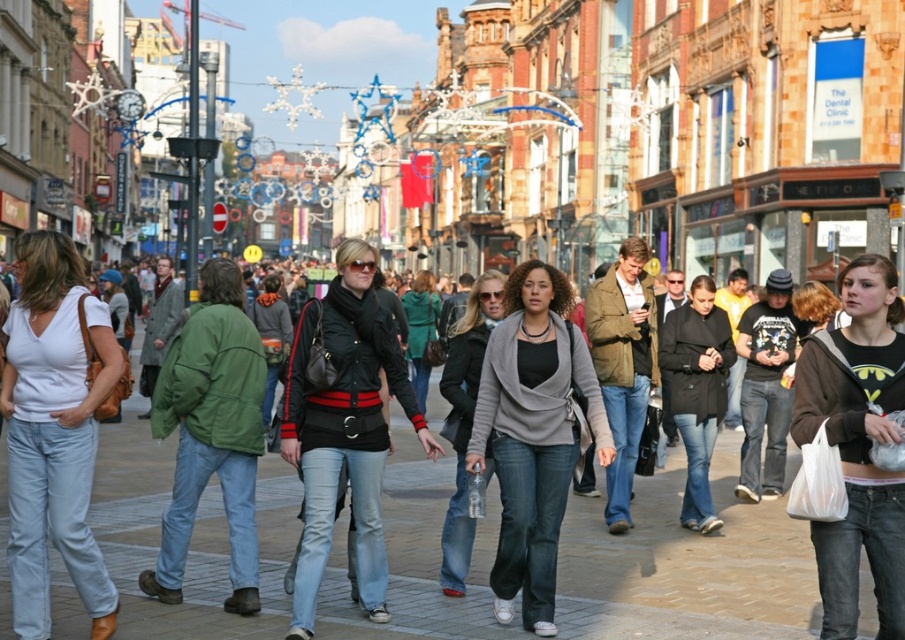
You are a photographer trying to capture a candid shot of the two people in the center of the busy street. The camera you are using has a narrow field of view that can only focus on items within a 20 cm width. Given that the white matte shirt at center is wider than the gray knit sweater at center, will you be able to fit both subjects into the frame without cropping either of them?

The white matte shirt at center is wider than the gray knit sweater at center, but the total combined width of both exceeds the camera frame of 20 cm. Therefore, it is not possible to fit both into the frame without cropping.

You are a photographer trying to capture both the white matte shirt at center and the gray knit sweater at center in a single shot. Which one will appear larger in the photo?

The white matte shirt at center will appear larger in the photo because it is closer to the viewer than the gray knit sweater at center.